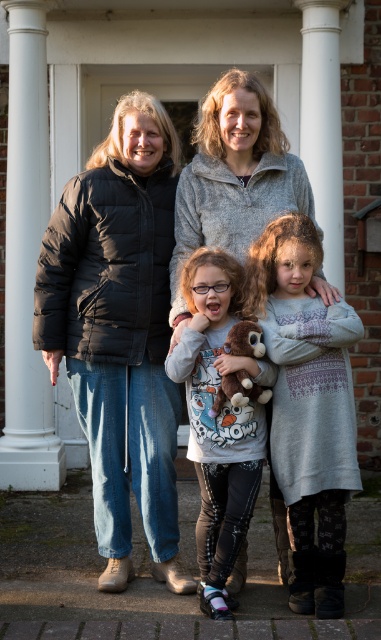
You are standing in front of the brick building and want to place a small flower pot between the two points marked as point (123, 353) and point (259, 83). Which point should the flower pot be closer to in order to be nearer to the foreground where the people are standing?

The flower pot should be closer to point (123, 353) because it is closer to the viewer than point (259, 83), which is further away.